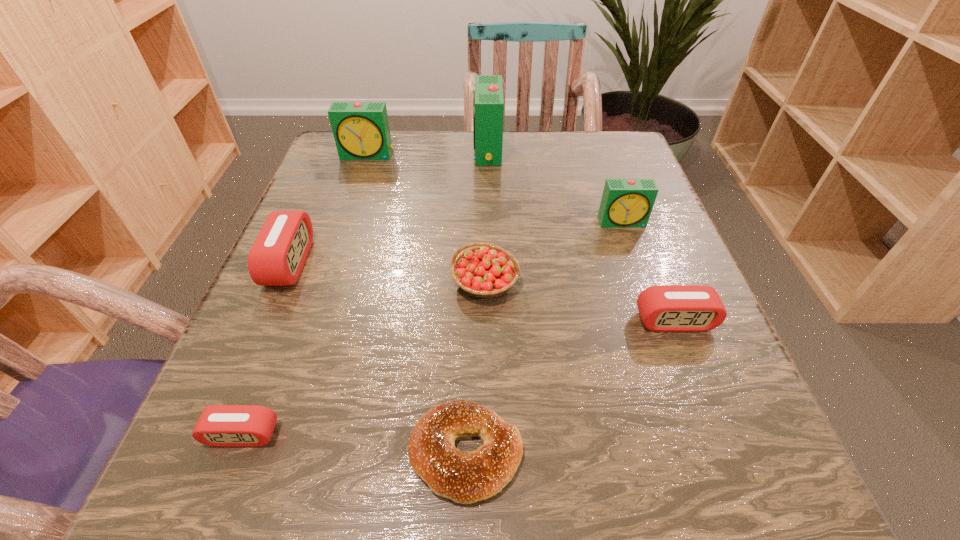
This screenshot has width=960, height=540. In the image, there is a desktop. In order to click on blank space at the right edge in this screenshot , I will do `click(586, 222)`.

Image resolution: width=960 pixels, height=540 pixels. Find the location of `vacant space at the far left corner of the desktop`. vacant space at the far left corner of the desktop is located at coordinates (331, 150).

Locate an element on the screen. vacant area at the far right corner of the desktop is located at coordinates (578, 172).

Locate an element on the screen. This screenshot has width=960, height=540. vacant region between the biggest green alarm clock and the brown strawberry is located at coordinates (486, 216).

Where is `free spot between the fifth farthest alarm clock and the biggest green alarm clock`? This screenshot has width=960, height=540. free spot between the fifth farthest alarm clock and the biggest green alarm clock is located at coordinates (581, 235).

Find the location of `blank region between the biggest green alarm clock and the sixth farthest object`. blank region between the biggest green alarm clock and the sixth farthest object is located at coordinates (581, 235).

Identify the location of free point between the shortest alarm clock and the second smallest green alarm clock. The image size is (960, 540). (305, 294).

Where is `free spot between the fourth tallest alarm clock and the brown bagel`? This screenshot has height=540, width=960. free spot between the fourth tallest alarm clock and the brown bagel is located at coordinates (378, 358).

This screenshot has width=960, height=540. What are the coordinates of `vacant space that is in between the second green alarm clock from left to right and the brown strawberry` in the screenshot? It's located at (486, 216).

Find the location of a particular element. The width and height of the screenshot is (960, 540). vacant space that is in between the second tallest object and the fourth alarm clock from left to right is located at coordinates (427, 152).